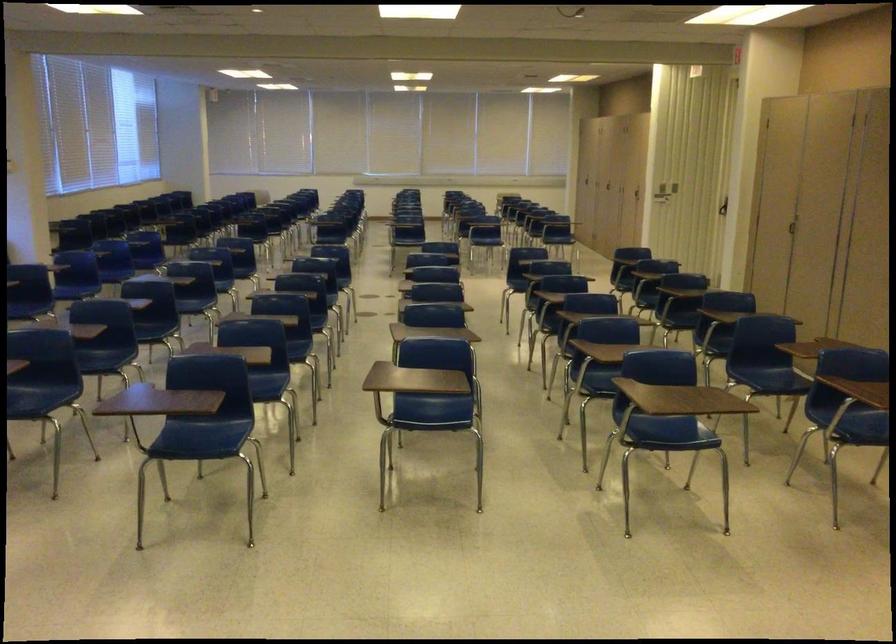
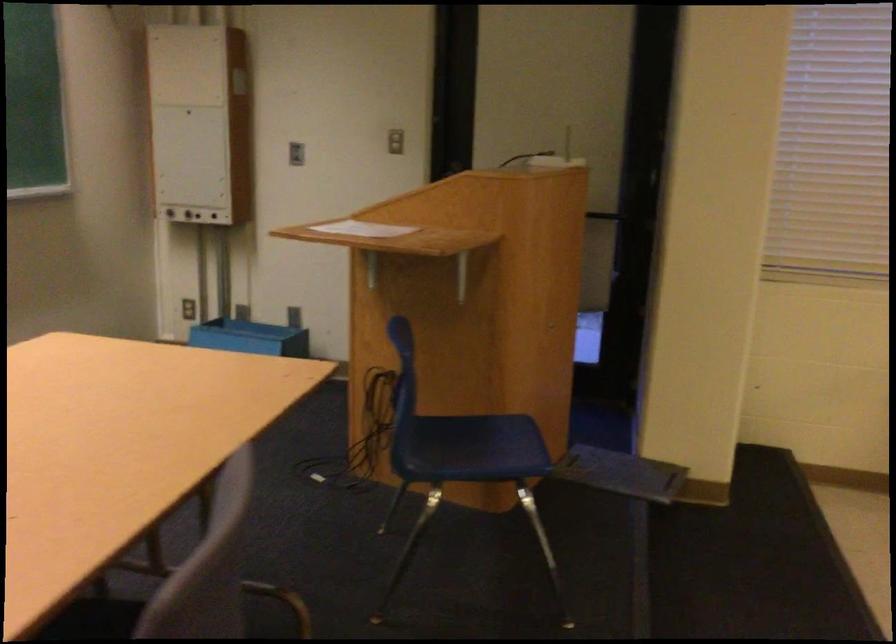
How did the camera likely rotate?

The camera's rotation is toward left-down.